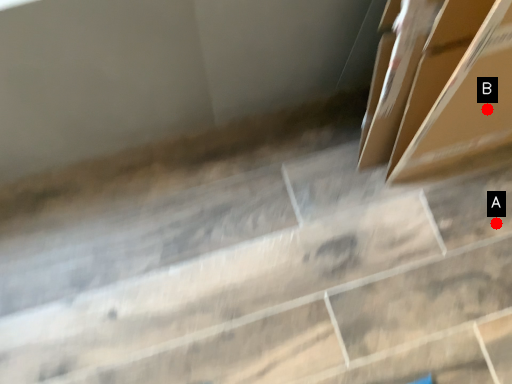
Question: Two points are circled on the image, labeled by A and B beside each circle. Which point is closer to the camera taking this photo?

Choices:
 (A) A is closer
 (B) B is closer

Answer: (B)